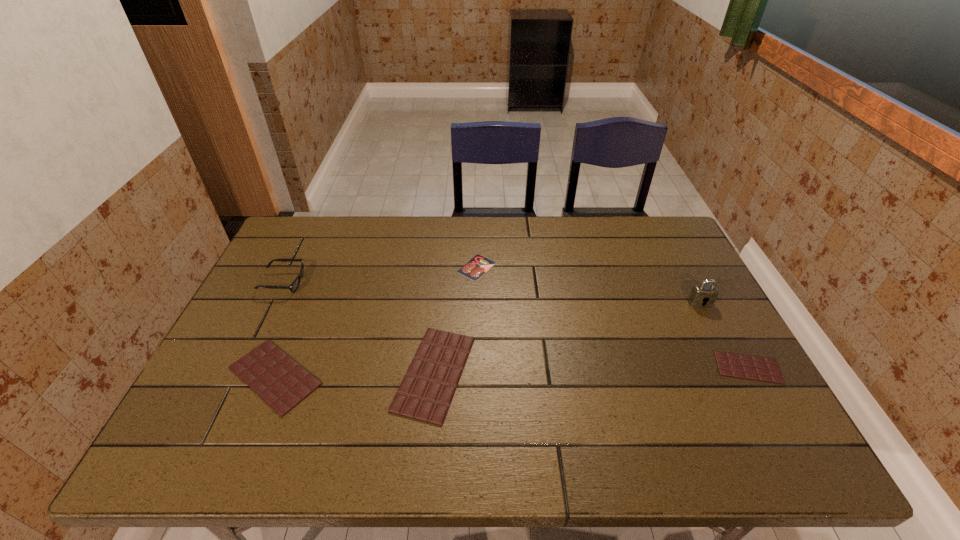
Identify the location of vacant area situated on the back of the second chocolate bar from left to right. (446, 242).

Where is `vacant area situated on the left of the rightmost chocolate bar`? vacant area situated on the left of the rightmost chocolate bar is located at coordinates (624, 367).

Identify the location of vacant space located 0.060m on the front-facing side of the fifth shortest object. The width and height of the screenshot is (960, 540). (324, 282).

The height and width of the screenshot is (540, 960). Identify the location of vacant region located 0.150m on the right of the shortest object. (543, 267).

I want to click on vacant region located at the front of the fourth nearest object near the keyhole, so click(x=732, y=365).

Locate an element on the screen. This screenshot has height=540, width=960. object at the far edge is located at coordinates (477, 266).

Image resolution: width=960 pixels, height=540 pixels. What are the coordinates of `chocolate bar that is positioned at the left edge` in the screenshot? It's located at (280, 381).

This screenshot has width=960, height=540. Identify the location of sunglasses that is at the left edge. (293, 287).

Identify the location of chocolate bar positioned at the right edge. (729, 364).

This screenshot has height=540, width=960. What are the coordinates of `padlock positioned at the right edge` in the screenshot? It's located at (700, 294).